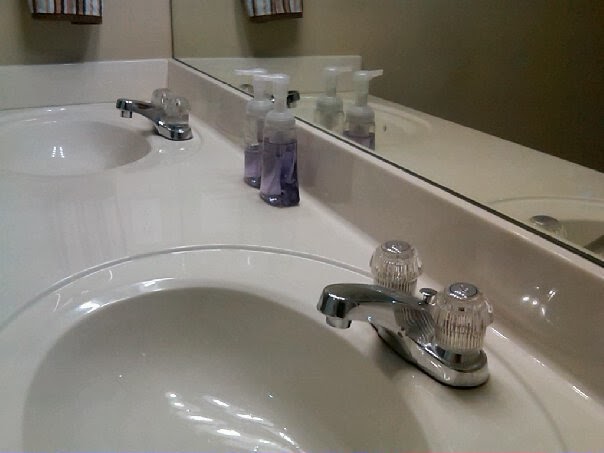
At what (x,y) coordinates should I click in order to perform the action: click on hand towel. Please return your answer as a coordinate pair (x, y). Image resolution: width=604 pixels, height=453 pixels. Looking at the image, I should click on (79, 9).